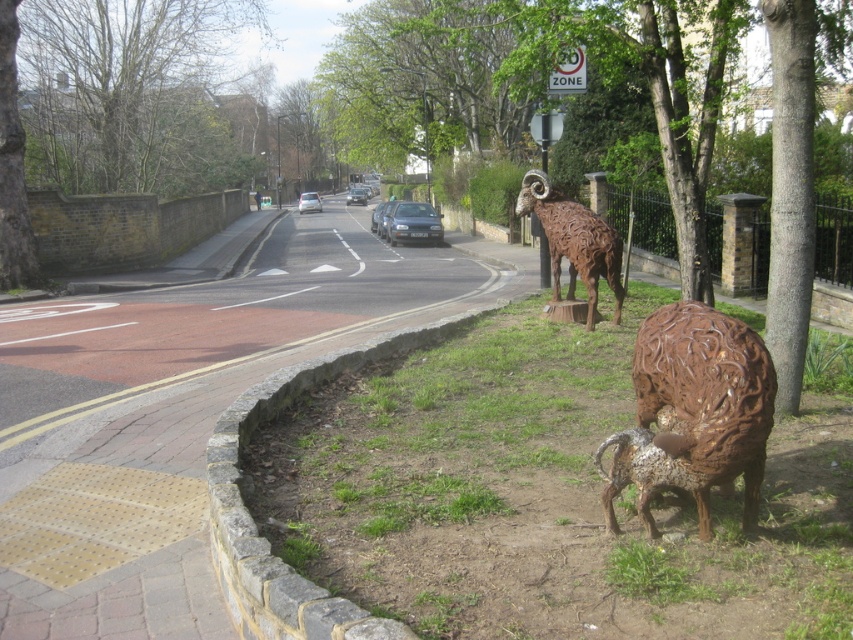
You are a delivery person trying to park your metallic silver car at center near the brown stone curb at lower center. Can you fit your car next to the curb without overlapping it?

The brown stone curb at lower center is smaller than the metallic silver car at center, so there is enough space to park the metallic silver car at center next to the curb without overlapping.

You are standing at the point marked as point (252, 518) in the image. What object is exactly at this location?

The brown stone curb at lower center is located at point (252, 518).

You are a delivery person trying to park your van near the brown stone curb at lower center and the rusty metal ram at center. Since the van requires a space of at least 3 meters in length, can you determine if the space between these two objects is sufficient?

The brown stone curb at lower center is smaller than the rusty metal ram at center, but the exact distance between them isn